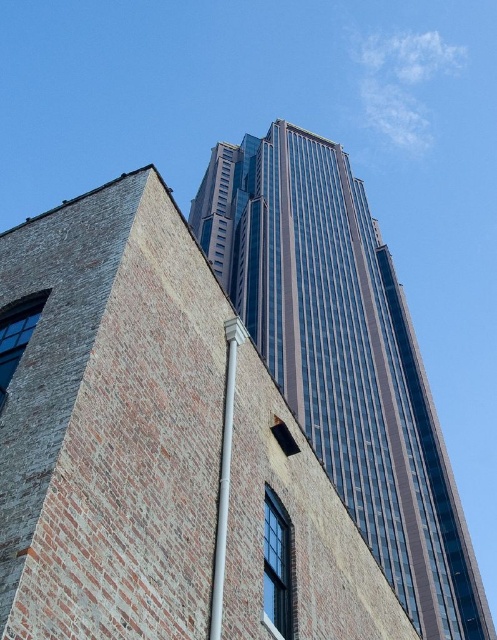
Question: Is glassy reflective skyscraper at center positioned in front of white plastic pipe at center?

Choices:
 (A) yes
 (B) no

Answer: (B)

Question: Does glassy reflective skyscraper at center have a lesser width compared to white plastic pipe at center?

Choices:
 (A) yes
 (B) no

Answer: (B)

Question: Which point is farther to the camera?

Choices:
 (A) white plastic pipe at center
 (B) glassy reflective skyscraper at center

Answer: (B)

Question: Can you confirm if glassy reflective skyscraper at center is smaller than white plastic pipe at center?

Choices:
 (A) no
 (B) yes

Answer: (A)

Question: Which point is closer to the camera taking this photo?

Choices:
 (A) (417, 490)
 (B) (220, 497)

Answer: (B)